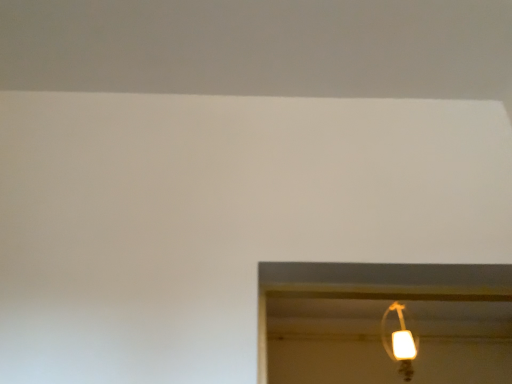
Question: Should I look upward or downward to see matte white lamp at upper right?

Choices:
 (A) up
 (B) down

Answer: (B)